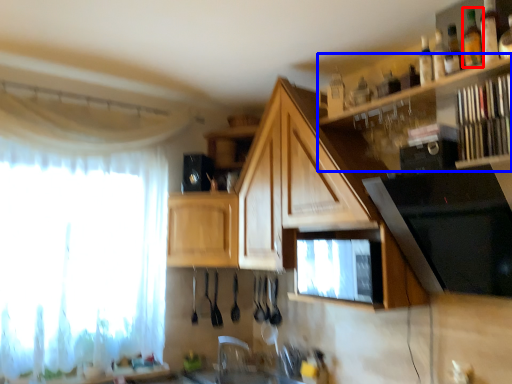
Question: Which point is closer to the camera, bottle (highlighted by a red box) or shelf (highlighted by a blue box)?

Choices:
 (A) bottle
 (B) shelf

Answer: (B)